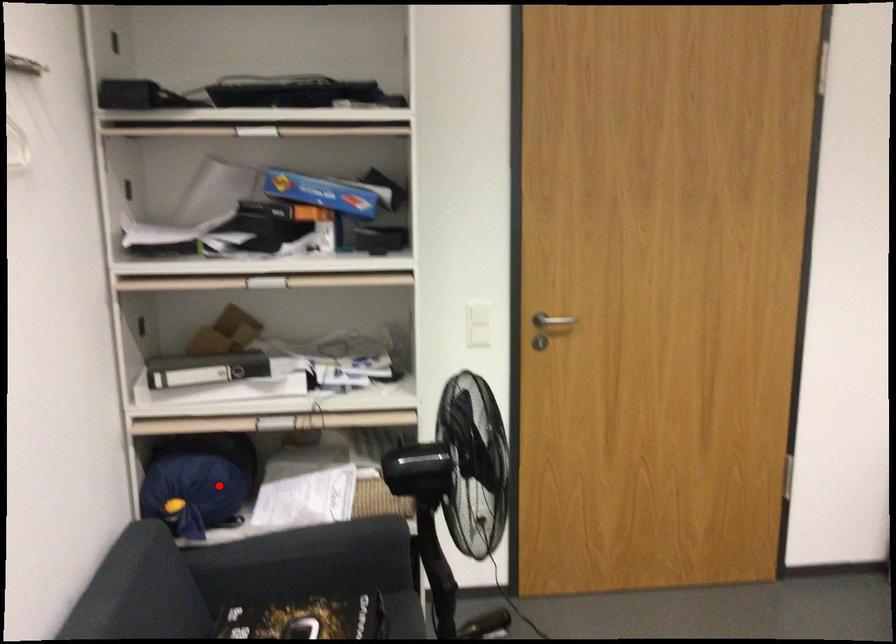
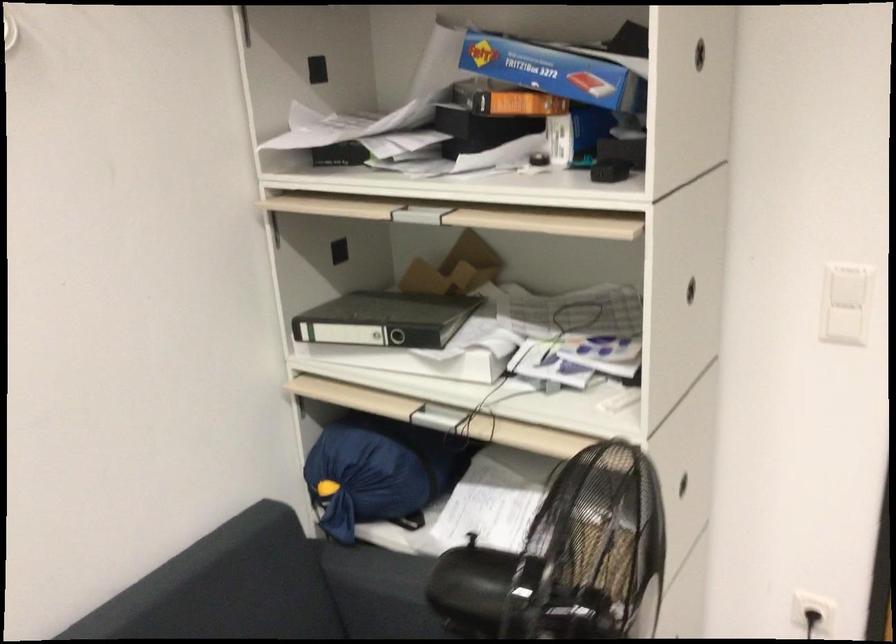
Find the pixel in the second image that matches the highlighted location in the first image.

(376, 471)